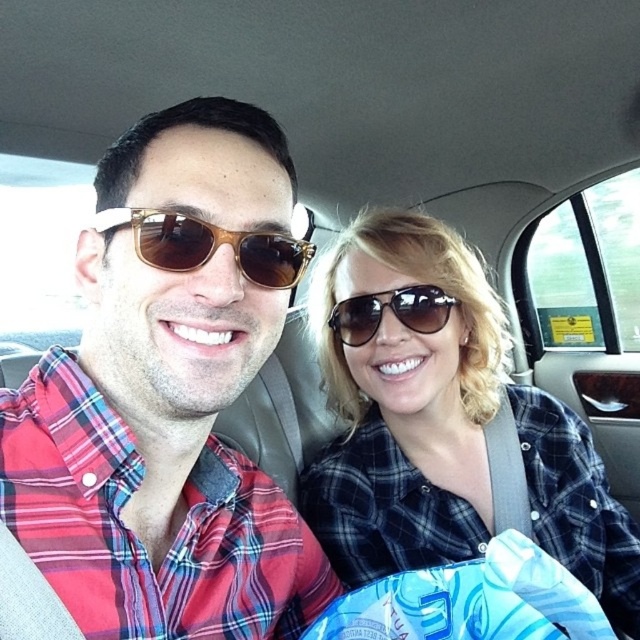
You are a photographer trying to capture a closeup of the matte black sunglasses at upper center and the brown wood sunglasses at center. Since the camera can only focus on one object at a time, which sunglasses should you focus on first to ensure it appears in focus, considering their relative positions?

The matte black sunglasses at upper center is much taller than the brown wood sunglasses at center, so focusing on the matte black sunglasses at upper center first would ensure it is in focus since it is closer to the camera.

Looking at this image, you are a fashion designer observing two items in the car interior. You need to determine which item is wider between the matte plaid shirt at center and the sunglasses at center. Which one is wider?

The matte plaid shirt at center is wider than the sunglasses at center as stated in the description.

You are a detective examining a photo of two people in a car. You notice the matte black sunglasses at upper center. Where exactly are they located in the photo?

The matte black sunglasses at upper center are located at point coordinates of (x=442, y=420).